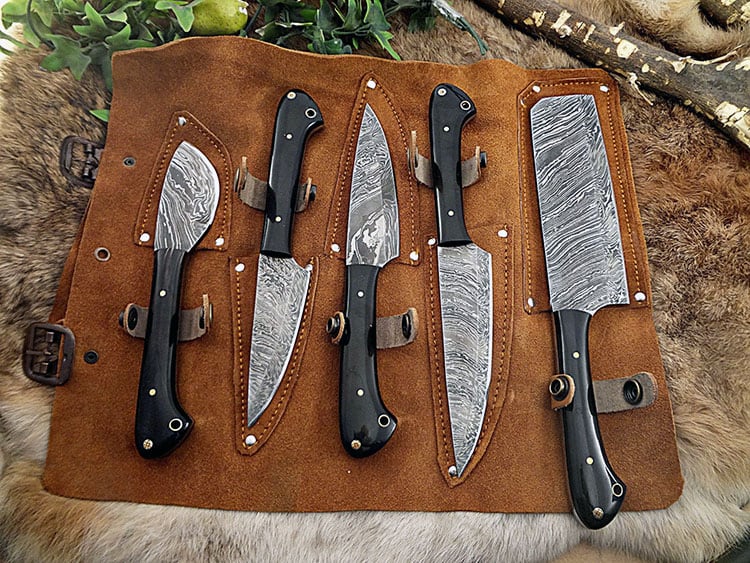
Where is `handles`? handles is located at coordinates (168, 323), (278, 171), (358, 327), (450, 187), (580, 387).